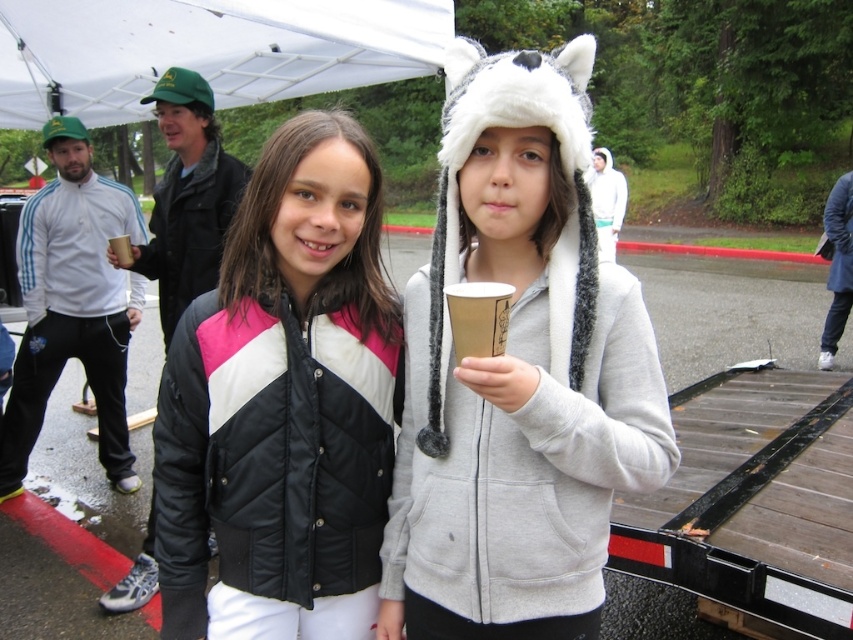
What object is located at the coordinate point (206, 51) in the image?

The white fabric canopy at upper center is located at the coordinate point (206, 51).

You are standing at the origin point of the coordinate system in the image. There is a point marked at coordinate (518, 372). What object is located at that point?

The point at coordinate (518, 372) indicates the gray fleece hoodie at center.